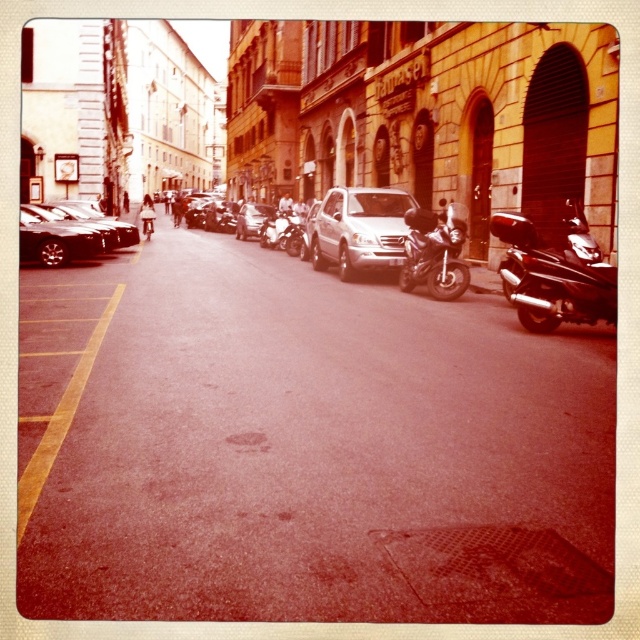
Question: Which object appears closest to the camera in this image?

Choices:
 (A) black matte motorcycle at center-right
 (B) shiny chrome motorcycle at right

Answer: (A)

Question: Does shiny black car at left appear on the left side of shiny silver car at center?

Choices:
 (A) yes
 (B) no

Answer: (A)

Question: Which object is closer to the camera taking this photo?

Choices:
 (A) shiny black car at left
 (B) shiny chrome motorcycle at right
 (C) black matte motorcycle at center-right
 (D) silver metallic van at center

Answer: (C)

Question: Can you confirm if black matte motorcycle at center-right is wider than metallic silver scooter at center?

Choices:
 (A) no
 (B) yes

Answer: (A)

Question: Does black matte motorcycle at center-right have a smaller size compared to shiny chrome motorcycle at right?

Choices:
 (A) no
 (B) yes

Answer: (B)

Question: Which object is the closest to the yellow asphalt at lower left?

Choices:
 (A) shiny chrome motorcycle at right
 (B) shiny silver car at center

Answer: (A)